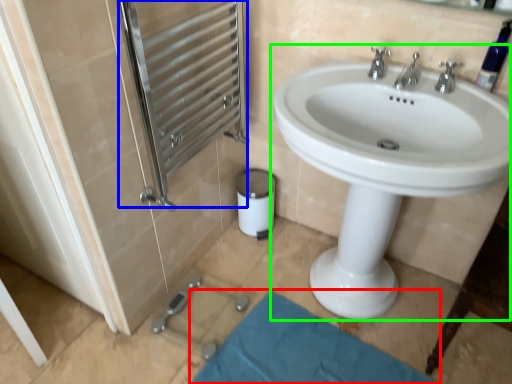
Question: Considering the real-world distances, which object is farthest from bath mat (highlighted by a red box)? screen door (highlighted by a blue box) or sink (highlighted by a green box)?

Choices:
 (A) screen door
 (B) sink

Answer: (A)